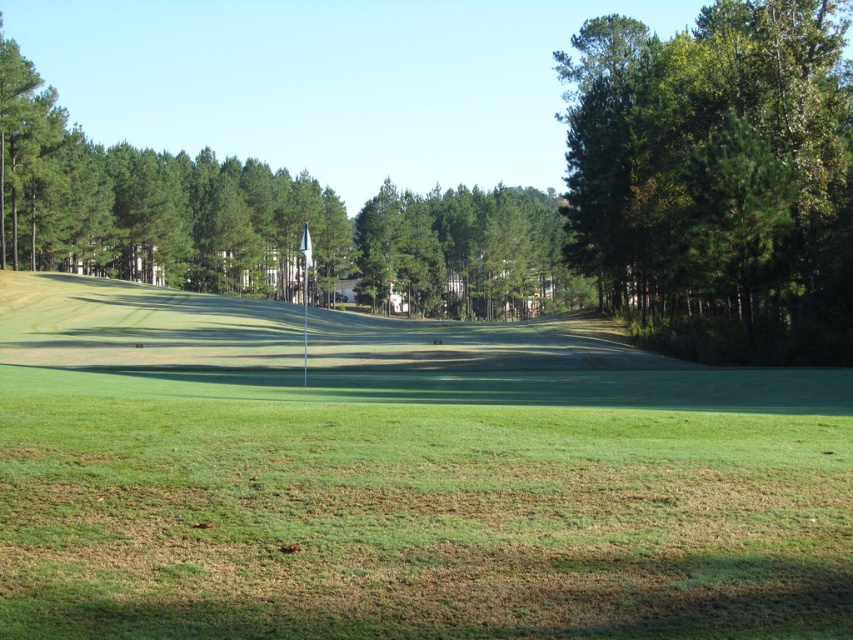
You are a golfer standing on the fairway and want to hit the ball towards the hole marked by the white flag. Which object, the green grass at center or the green leafy tree at upper right, is closer to your current position?

The green grass at center is closer to your current position because it is shorter than the green leafy tree at upper right, which is taller and likely further away.